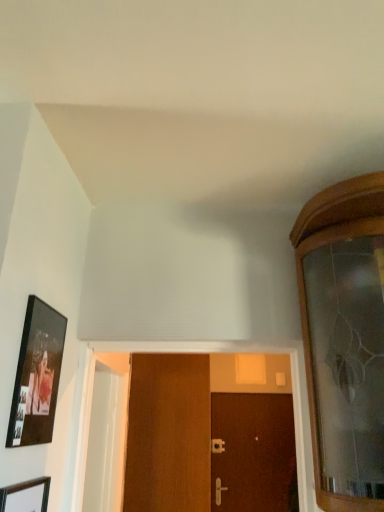
Question: Is brown wooden door at center, which is counted as the second door, starting from the front, behind silver metallic door handle at center, the first door handle positioned from the top?

Choices:
 (A) no
 (B) yes

Answer: (A)

Question: Is the surface of brown wooden door at center, the 1th door positioned from the bottom, in direct contact with silver metallic door handle at center, the first door handle positioned from the top?

Choices:
 (A) yes
 (B) no

Answer: (B)

Question: Is silver metallic door handle at center, acting as the second door handle starting from the front, at the back of brown wooden door at center, arranged as the second door when viewed from the left?

Choices:
 (A) no
 (B) yes

Answer: (B)

Question: From the image's perspective, is brown wooden door at center, the 1th door viewed from the right, above silver metallic door handle at center, which appears as the 1th door handle when viewed from the back?

Choices:
 (A) no
 (B) yes

Answer: (A)

Question: Is brown wooden door at center, the 1th door positioned from the bottom, smaller than silver metallic door handle at center, acting as the second door handle starting from the front?

Choices:
 (A) yes
 (B) no

Answer: (B)

Question: From the image's perspective, is brown wooden door at center, arranged as the second door when viewed from the left, beneath silver metallic door handle at center, the first door handle positioned from the top?

Choices:
 (A) yes
 (B) no

Answer: (A)

Question: Does wooden picture frame at lower left, arranged as the 2th picture frame when viewed from the top, have a greater width compared to satin gold door handle at center, which is the 1th door handle from front to back?

Choices:
 (A) yes
 (B) no

Answer: (B)

Question: Can you confirm if wooden picture frame at lower left, arranged as the 2th picture frame when viewed from the top, is thinner than satin gold door handle at center, arranged as the 1th door handle when ordered from the bottom?

Choices:
 (A) yes
 (B) no

Answer: (A)

Question: From a real-world perspective, is wooden picture frame at lower left, placed as the first picture frame when sorted from bottom to top, below satin gold door handle at center, which is the second door handle from top to bottom?

Choices:
 (A) no
 (B) yes

Answer: (A)

Question: Is wooden picture frame at lower left, arranged as the 2th picture frame when viewed from the top, bigger than satin gold door handle at center, which is the 1th door handle from front to back?

Choices:
 (A) yes
 (B) no

Answer: (A)

Question: Is wooden picture frame at lower left, placed as the first picture frame when sorted from bottom to top, shorter than satin gold door handle at center, which is the 1th door handle from front to back?

Choices:
 (A) yes
 (B) no

Answer: (B)

Question: Is wooden picture frame at lower left, arranged as the 2th picture frame when viewed from the top, smaller than satin gold door handle at center, which is the second door handle from top to bottom?

Choices:
 (A) no
 (B) yes

Answer: (A)

Question: Considering the relative sizes of wooden door at center, which is the first door in top-to-bottom order, and satin gold door handle at center, acting as the 2th door handle starting from the back, in the image provided, is wooden door at center, which is the first door in top-to-bottom order, taller than satin gold door handle at center, acting as the 2th door handle starting from the back,?

Choices:
 (A) no
 (B) yes

Answer: (B)